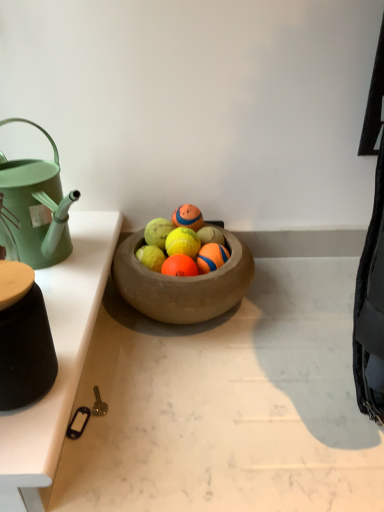
Question: Based on their positions, is white glossy table at left located to the left or right of orange rubber ball at center, positioned as the third fruit in left-to-right order?

Choices:
 (A) left
 (B) right

Answer: (A)

Question: In terms of height, does white glossy table at left look taller or shorter compared to orange rubber ball at center, positioned as the third fruit in left-to-right order?

Choices:
 (A) short
 (B) tall

Answer: (A)

Question: Estimate the real-world distances between objects in this image. Which object is farther from the yellow rubber tennis ball at center, positioned as the 2th fruit in left-to-right order?

Choices:
 (A) orange rubber ball at center, which is counted as the first fruit, starting from the left
 (B) rubber textured tennis ball at center
 (C) white glossy table at left
 (D) orange rubber ball at center, acting as the first fruit starting from the right

Answer: (C)

Question: Considering the real-world distances, which object is farthest from the rubber textured tennis ball at center?

Choices:
 (A) yellow rubber tennis ball at center, positioned as the 2th fruit in left-to-right order
 (B) orange rubber ball at center, which is counted as the first fruit, starting from the left
 (C) orange rubber ball at center, positioned as the third fruit in left-to-right order
 (D) white glossy table at left

Answer: (D)